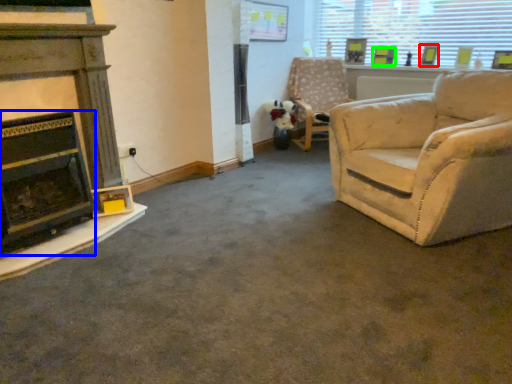
Question: Which is nearer to the picture frame (highlighted by a red box)? fireplace (highlighted by a blue box) or picture frame (highlighted by a green box).

Choices:
 (A) fireplace
 (B) picture frame

Answer: (B)